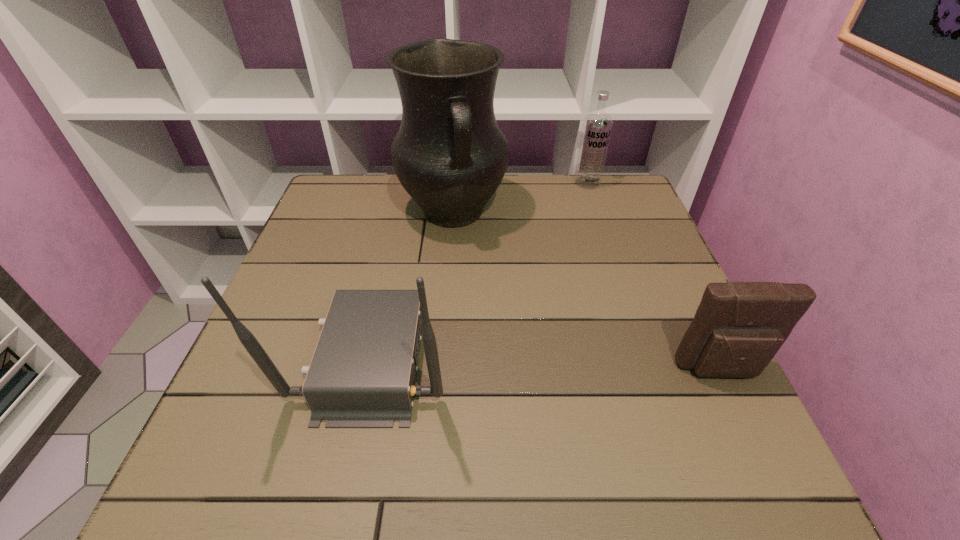
Find the location of `free spot on the desktop that is between the router and the shortest object and is positioned on the handle side of the tallest object`. free spot on the desktop that is between the router and the shortest object and is positioned on the handle side of the tallest object is located at coordinates (507, 362).

Identify the location of vacant spot on the desktop that is between the router and the rightmost object and is positioned on the front label of the third object from left to right. This screenshot has height=540, width=960. point(592,366).